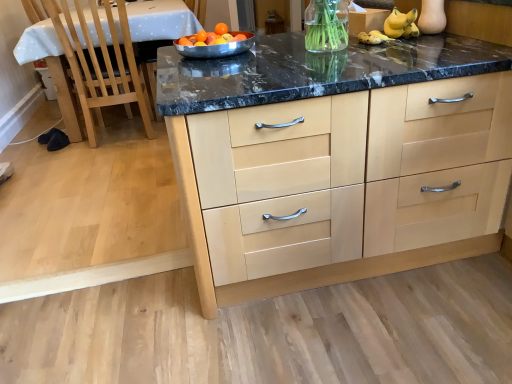
Locate an element on the screen. The image size is (512, 384). free space above stainless steel bowl at center (from a real-world perspective) is located at coordinates (208, 37).